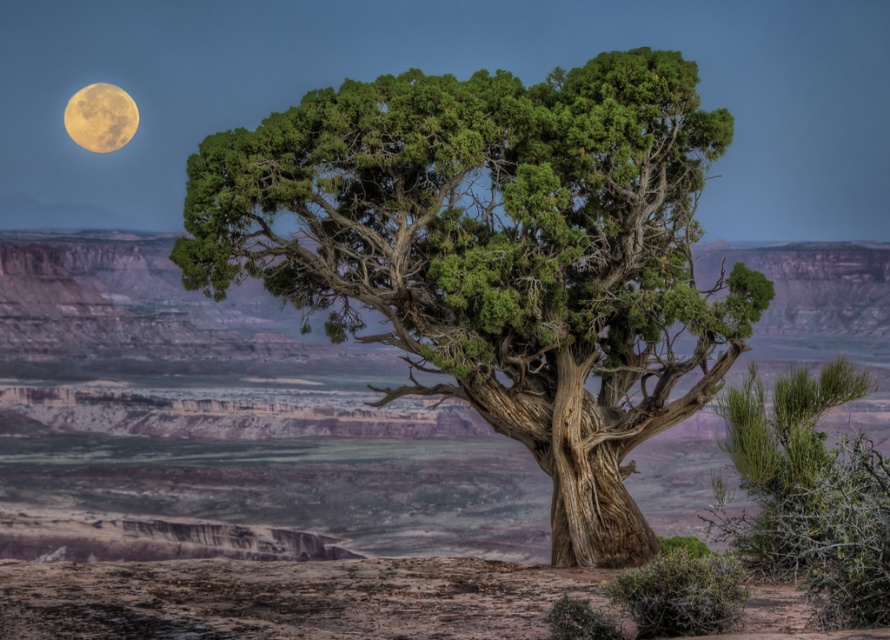
You are an astronaut on the moon who wants to take a photo of the green textured tree at center and the yellowish matte moon at upper left. However, your camera can only focus on objects within a 500 meter range. Given that the tree is closer to you than the moon, can you capture both in one photo?

The green textured tree at center is bigger than the yellowish matte moon at upper left, but size doesn not determine distance. Since the tree is closer to you than the moon, the camera can focus on both as long as the moon is within the 500 meter range. However, the moon is likely much farther away than 500 meters, so it might not be in focus.

You are a hiker planning to navigate from the point at coordinates point (612,362) to the point at coordinates point (110,102). Based on the image, which direction should you move relative to the solitary tree?

Since point (612,362) is in front of point (110,102), you should move towards the direction away from the solitary tree to reach point (110,102).